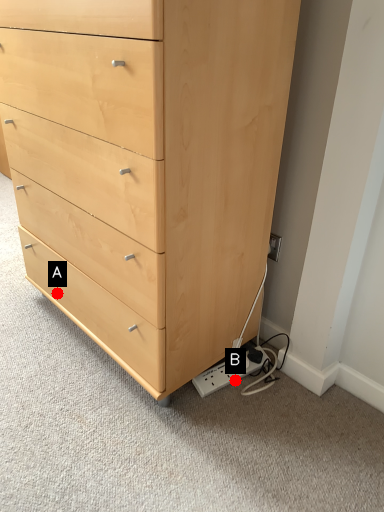
Question: Two points are circled on the image, labeled by A and B beside each circle. Which point appears closest to the camera in this image?

Choices:
 (A) A is closer
 (B) B is closer

Answer: (B)